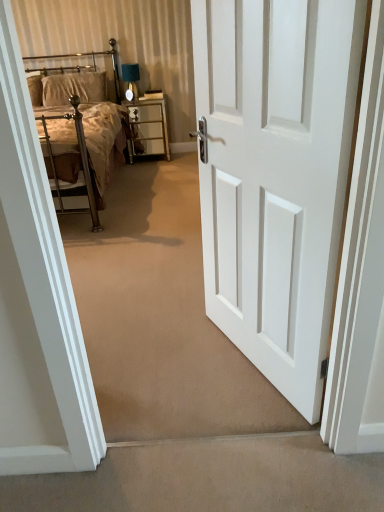
Question: Is white painted wood door at center taller than velvet beige pillow at upper left?

Choices:
 (A) no
 (B) yes

Answer: (B)

Question: From a real-world perspective, is white painted wood door at center physically above velvet beige pillow at upper left?

Choices:
 (A) yes
 (B) no

Answer: (B)

Question: Is white painted wood door at center oriented towards velvet beige pillow at upper left?

Choices:
 (A) no
 (B) yes

Answer: (A)

Question: Would you say velvet beige pillow at upper left is part of white painted wood door at center's contents?

Choices:
 (A) no
 (B) yes

Answer: (A)

Question: Is white painted wood door at center touching velvet beige pillow at upper left?

Choices:
 (A) no
 (B) yes

Answer: (A)

Question: Would you say metallic gold nightstand at center is inside or outside white painted wood door at center?

Choices:
 (A) inside
 (B) outside

Answer: (B)

Question: Considering the positions of metallic gold nightstand at center and white painted wood door at center in the image, is metallic gold nightstand at center bigger or smaller than white painted wood door at center?

Choices:
 (A) small
 (B) big

Answer: (B)

Question: From the image's perspective, is metallic gold nightstand at center above or below white painted wood door at center?

Choices:
 (A) below
 (B) above

Answer: (B)

Question: Considering the positions of metallic gold nightstand at center and white painted wood door at center in the image, is metallic gold nightstand at center wider or thinner than white painted wood door at center?

Choices:
 (A) wide
 (B) thin

Answer: (A)

Question: Is beige carpet at lower center inside or outside of white painted wood door at center?

Choices:
 (A) outside
 (B) inside

Answer: (A)

Question: Visually, is beige carpet at lower center positioned to the left or to the right of white painted wood door at center?

Choices:
 (A) left
 (B) right

Answer: (A)

Question: Is beige carpet at lower center in front of or behind white painted wood door at center in the image?

Choices:
 (A) front
 (B) behind

Answer: (B)

Question: Is point click(x=190, y=487) closer or farther from the camera than point click(x=220, y=220)?

Choices:
 (A) farther
 (B) closer

Answer: (B)

Question: Does point (311, 40) appear closer or farther from the camera than point (41, 138)?

Choices:
 (A) closer
 (B) farther

Answer: (A)

Question: Considering the relative positions of white painted wood door at center and metallic silver bed at upper left in the image provided, is white painted wood door at center to the left or to the right of metallic silver bed at upper left?

Choices:
 (A) right
 (B) left

Answer: (A)